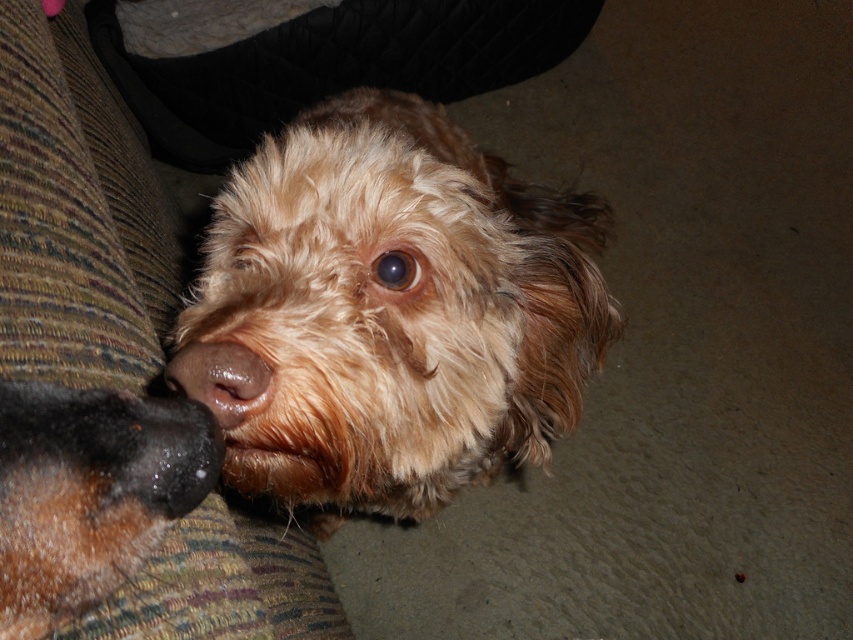
Question: Which point is farther to the camera?

Choices:
 (A) (502, 448)
 (B) (193, 380)
 (C) (15, 625)

Answer: (A)

Question: Is fuzzy brown dog at center further to camera compared to brown matte nose at center?

Choices:
 (A) yes
 (B) no

Answer: (A)

Question: Does brown fuzzy nose at left appear over brown matte nose at center?

Choices:
 (A) yes
 (B) no

Answer: (B)

Question: Considering the real-world distances, which object is closest to the brown fuzzy nose at left?

Choices:
 (A) fuzzy brown dog at center
 (B) brown matte nose at center

Answer: (B)

Question: Which object is closer to the camera taking this photo?

Choices:
 (A) brown matte nose at center
 (B) brown fuzzy nose at left
 (C) fuzzy brown dog at center

Answer: (B)

Question: Is brown fuzzy nose at left positioned before brown matte nose at center?

Choices:
 (A) no
 (B) yes

Answer: (B)